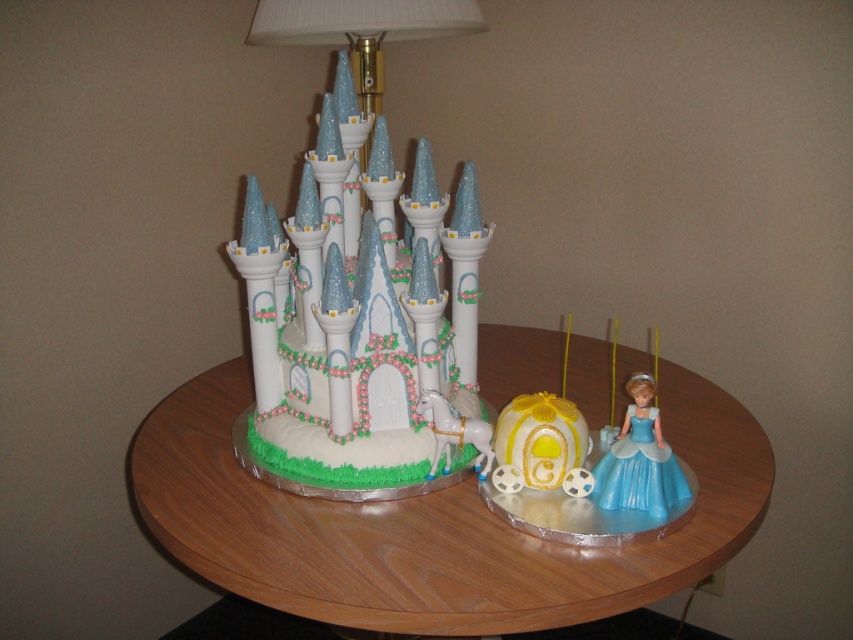
Is point (392, 182) farther from viewer compared to point (543, 483)?

Yes, point (392, 182) is farther from viewer.

The width and height of the screenshot is (853, 640). I want to click on white fondant castle at center, so click(x=366, y=326).

Between white fondant castle at center and satin blue dress at lower right, which one has less height?

satin blue dress at lower right is shorter.

Is point (283, 417) less distant than point (654, 436)?

No, (283, 417) is behind (654, 436).

Locate an element on the screen. This screenshot has height=640, width=853. white fondant castle at center is located at coordinates (366, 326).

Can you confirm if wooden table at center is positioned below satin blue dress at lower right?

Yes, wooden table at center is below satin blue dress at lower right.

Image resolution: width=853 pixels, height=640 pixels. I want to click on wooden table at center, so click(x=430, y=525).

In the scene shown: Who is more forward, (223,458) or (647,378)?

Positioned in front is point (647,378).

At what (x,y) coordinates should I click in order to perform the action: click on wooden table at center. Please return your answer as a coordinate pair (x, y). The height and width of the screenshot is (640, 853). Looking at the image, I should click on (430, 525).